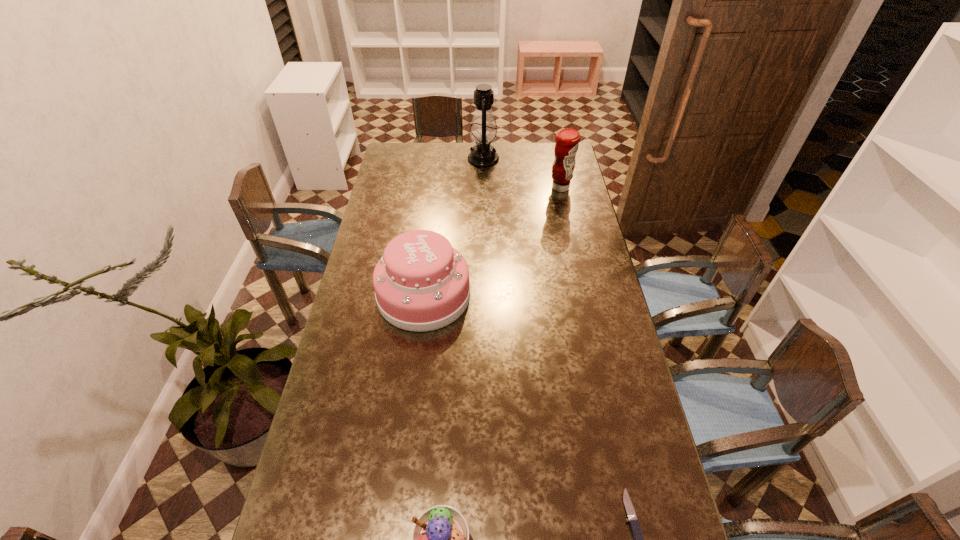
The height and width of the screenshot is (540, 960). I want to click on the tallest object, so click(x=483, y=132).

Locate an element on the screen. oil lamp is located at coordinates (483, 132).

Image resolution: width=960 pixels, height=540 pixels. Identify the location of condiment. (567, 140).

Find the location of `the fourth shortest object`. the fourth shortest object is located at coordinates (567, 140).

Find the location of a particular element. The height and width of the screenshot is (540, 960). cake is located at coordinates (421, 283).

Locate an element on the screen. The width and height of the screenshot is (960, 540). the third nearest object is located at coordinates (421, 283).

Locate an element on the screen. vacant space located on the front of the oil lamp is located at coordinates (484, 197).

At what (x,y) coordinates should I click in order to perform the action: click on free location located on the left of the fourth shortest object. Please return your answer as a coordinate pair (x, y). This screenshot has width=960, height=540. Looking at the image, I should click on (461, 188).

This screenshot has height=540, width=960. Find the location of `vacant space located 0.140m on the back of the cake`. vacant space located 0.140m on the back of the cake is located at coordinates (431, 239).

Image resolution: width=960 pixels, height=540 pixels. I want to click on object at the far edge, so click(483, 132).